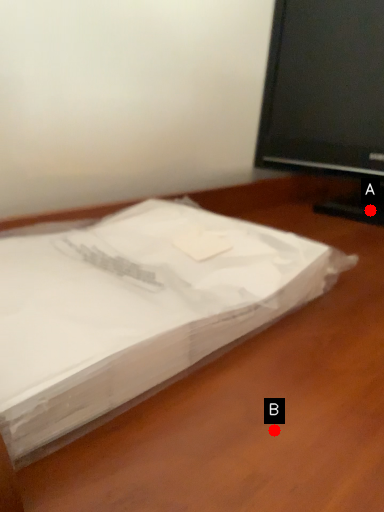
Question: Two points are circled on the image, labeled by A and B beside each circle. Among these points, which one is nearest to the camera?

Choices:
 (A) A is closer
 (B) B is closer

Answer: (B)